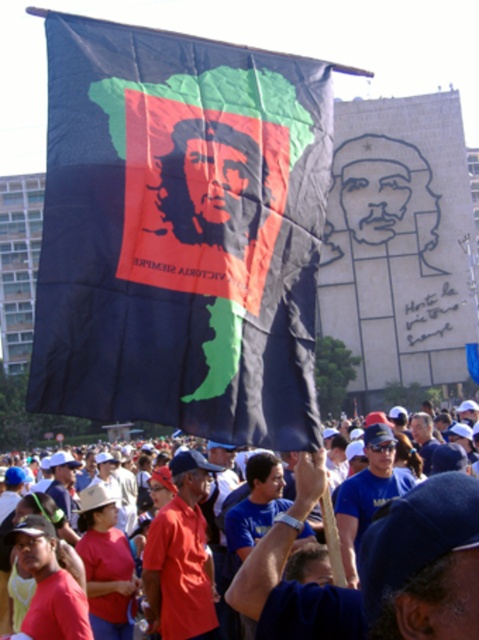
Question: From the image, what is the correct spatial relationship of matte black flag at upper center in relation to blue fabric at center?

Choices:
 (A) above
 (B) below

Answer: (A)

Question: Considering the relative positions of black fabric flag at center and red shirt at center in the image provided, where is black fabric flag at center located with respect to red shirt at center?

Choices:
 (A) below
 (B) above

Answer: (B)

Question: Which of the following is the farthest from the observer?

Choices:
 (A) red shirt at center
 (B) black fabric flag at center
 (C) matte black flag at center
 (D) blue fabric at center

Answer: (A)

Question: Considering the real-world distances, which object is farthest from the red shirt at center?

Choices:
 (A) black fabric flag at center
 (B) matte black flag at center

Answer: (A)

Question: Does black fabric flag at center appear on the right side of red shirt at center?

Choices:
 (A) no
 (B) yes

Answer: (B)

Question: Among these objects, which one is farthest from the camera?

Choices:
 (A) matte black flag at upper center
 (B) black fabric flag at center

Answer: (B)